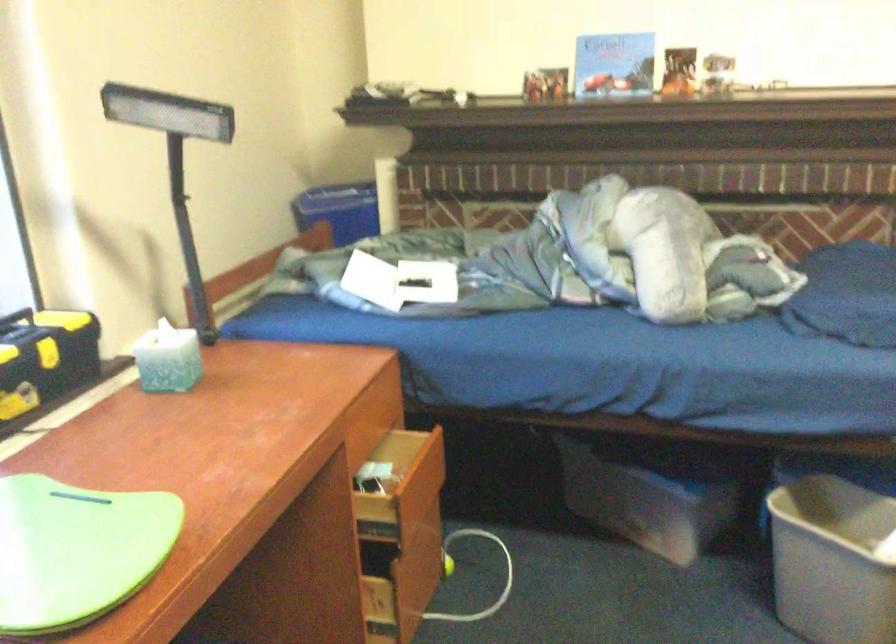
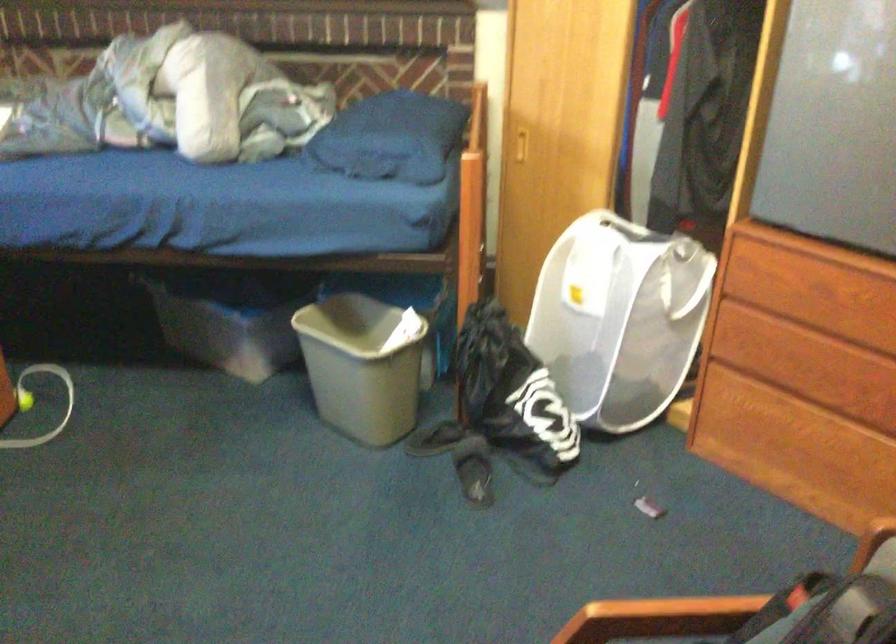
Question: The first image is from the beginning of the video and the second image is from the end. How did the camera likely rotate when shooting the video?

Choices:
 (A) Left
 (B) Right
 (C) Up
 (D) Down

Answer: (B)